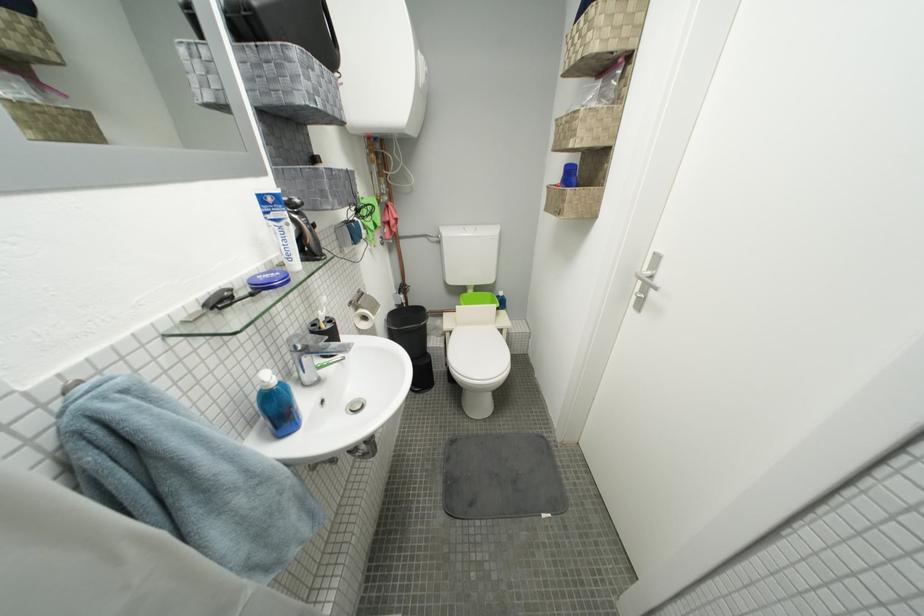
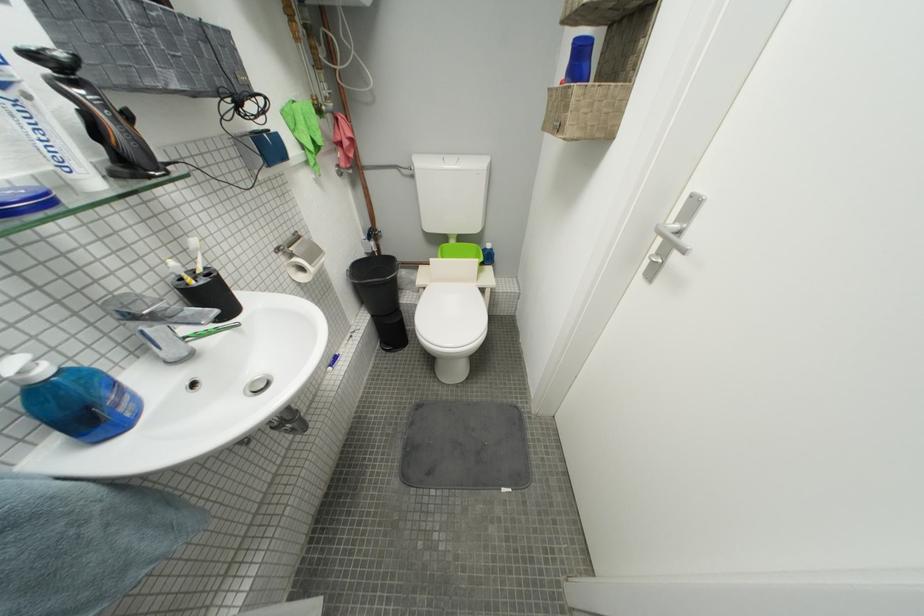
Where in the second image is the point corresponding to point 307,268 from the first image?

(103, 185)